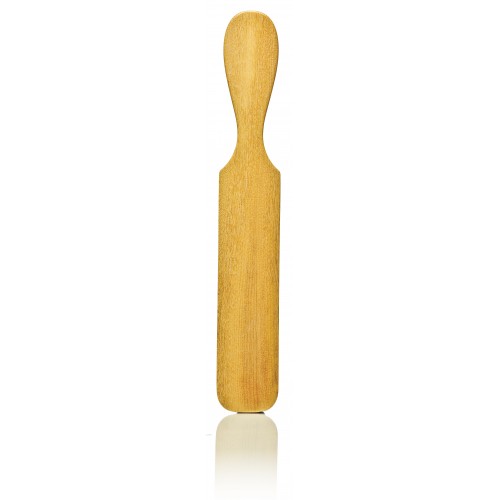
Image resolution: width=500 pixels, height=500 pixels. I want to click on handle, so [x=255, y=107].